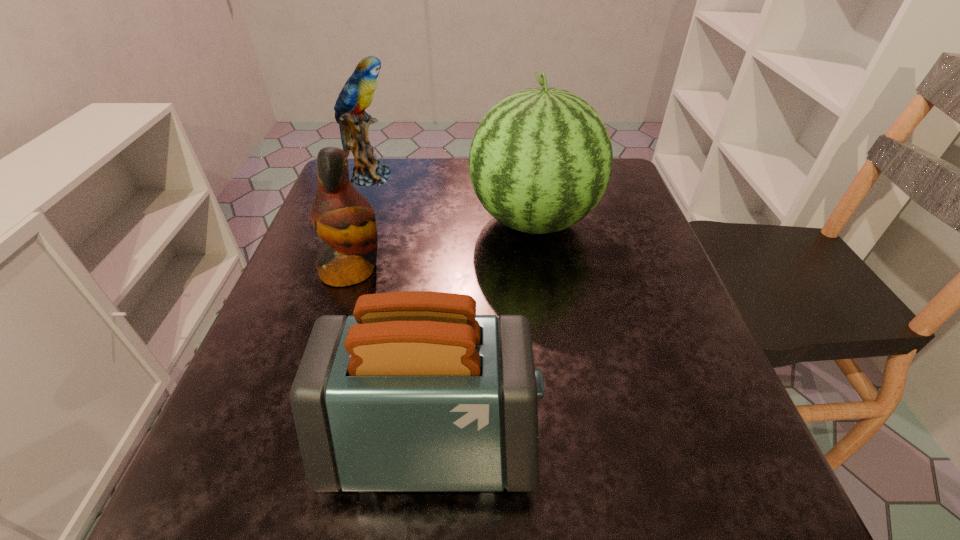
Where is `empty space between the farther parrot and the watermelon`? Image resolution: width=960 pixels, height=540 pixels. empty space between the farther parrot and the watermelon is located at coordinates (452, 199).

At what (x,y) coordinates should I click in order to perform the action: click on vacant area that lies between the watermelon and the nearer parrot. Please return your answer as a coordinate pair (x, y). This screenshot has width=960, height=540. Looking at the image, I should click on (443, 245).

The image size is (960, 540). I want to click on vacant point located between the watermelon and the farther parrot, so click(452, 199).

The width and height of the screenshot is (960, 540). Identify the location of free space between the nearer parrot and the watermelon. (443, 245).

Locate an element on the screen. object that is the third closest one to the nearer parrot is located at coordinates (357, 94).

Find the location of a particular element. Image resolution: width=960 pixels, height=540 pixels. object that stands as the third closest to the nearer parrot is located at coordinates (357, 94).

At what (x,y) coordinates should I click in order to perform the action: click on vacant area that satisfies the following two spatial constraints: 1. on the face of the watermelon; 2. on the left side of the farther parrot. Please return your answer as a coordinate pair (x, y). This screenshot has height=540, width=960. Looking at the image, I should click on (354, 221).

Where is `free space that satisfies the following two spatial constraints: 1. on the face of the farther parrot; 2. on the back side of the watermelon`? The image size is (960, 540). free space that satisfies the following two spatial constraints: 1. on the face of the farther parrot; 2. on the back side of the watermelon is located at coordinates (354, 221).

At what (x,y) coordinates should I click in order to perform the action: click on vacant space that satisfies the following two spatial constraints: 1. on the face of the farther parrot; 2. on the left side of the watermelon. Please return your answer as a coordinate pair (x, y). This screenshot has width=960, height=540. Looking at the image, I should click on (354, 221).

Where is `free space that satisfies the following two spatial constraints: 1. on the face of the farther parrot; 2. on the back side of the watermelon`? Image resolution: width=960 pixels, height=540 pixels. free space that satisfies the following two spatial constraints: 1. on the face of the farther parrot; 2. on the back side of the watermelon is located at coordinates (354, 221).